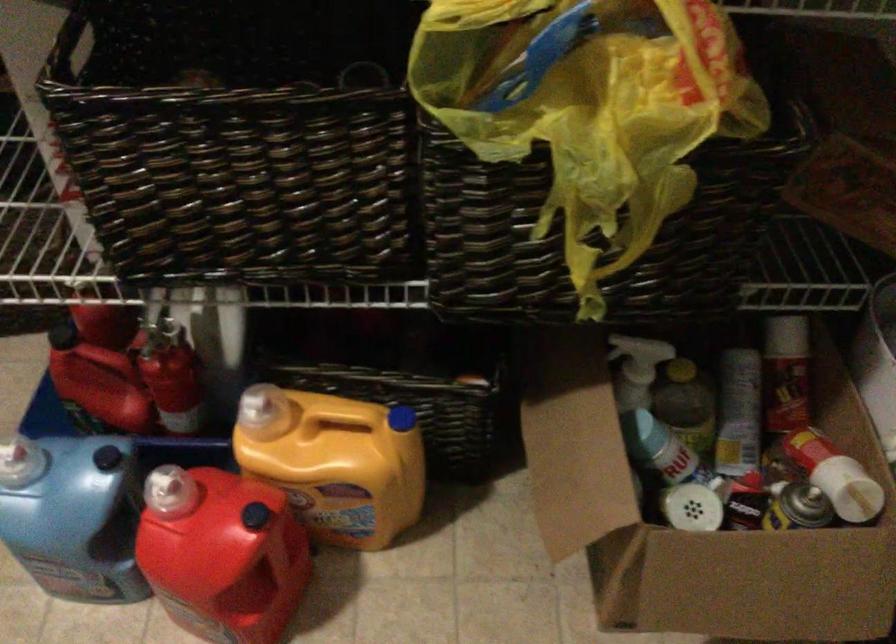
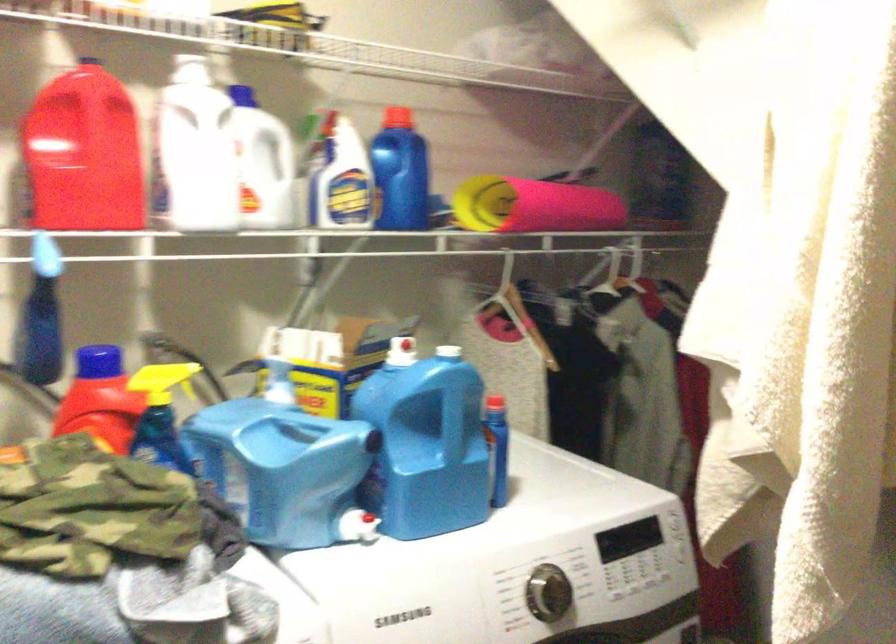
Based on the continuous images, in which direction is the camera rotating?

The rotation direction of the camera is left-up.